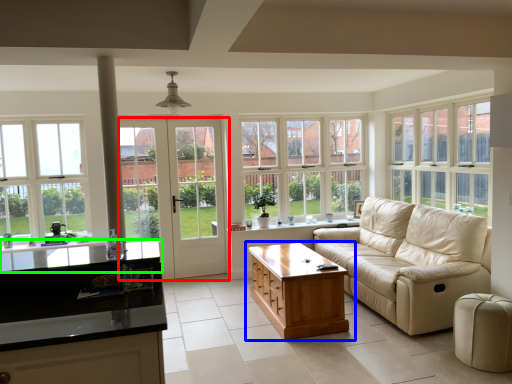
Question: Which is nearer to the door (highlighted by a red box)? table (highlighted by a blue box) or countertop (highlighted by a green box).

Choices:
 (A) table
 (B) countertop

Answer: (A)